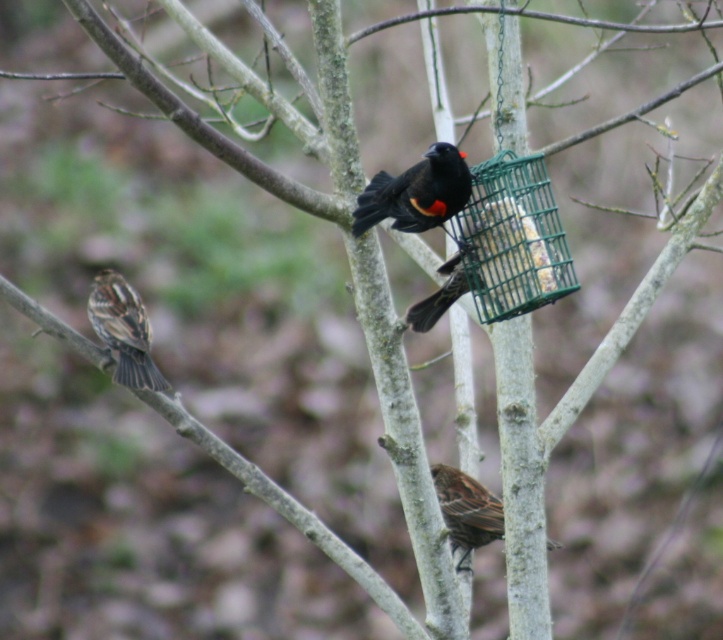
Question: Among these points, which one is nearest to the camera?

Choices:
 (A) (440, 209)
 (B) (487, 241)
 (C) (482, 541)
 (D) (136, 346)

Answer: (A)

Question: Which of the following is the closest to the observer?

Choices:
 (A) (450, 179)
 (B) (100, 321)

Answer: (A)

Question: Is green wire mesh bird feeder at upper right smaller than black glossy sparrow at center?

Choices:
 (A) no
 (B) yes

Answer: (A)

Question: Which point is closer to the camera?

Choices:
 (A) (89, 317)
 (B) (474, 518)
 (C) (408, 220)
 (D) (432, 292)

Answer: (C)

Question: Is green wire mesh bird feeder at upper right below black glossy sparrow at center?

Choices:
 (A) no
 (B) yes

Answer: (B)

Question: Does black glossy sparrow at center appear on the right side of shiny black bird at center?

Choices:
 (A) yes
 (B) no

Answer: (B)